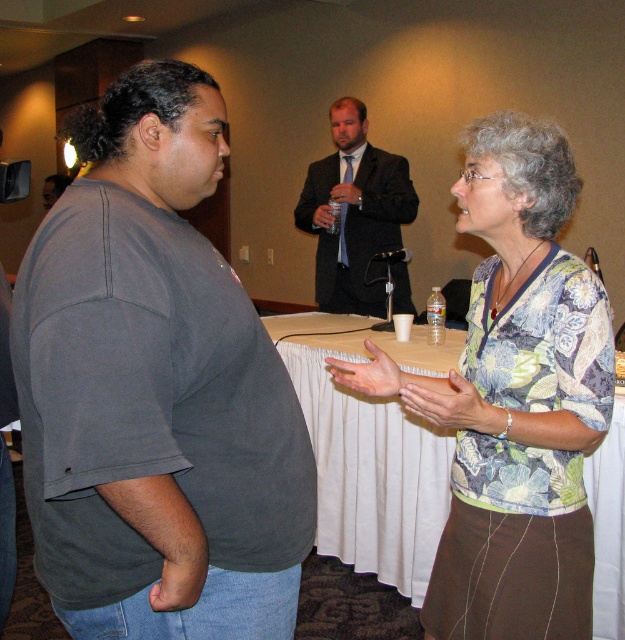
Does dark gray t-shirt at left appear under dark gray suit at center?

Yes, dark gray t-shirt at left is below dark gray suit at center.

Does dark gray t-shirt at left have a lesser width compared to dark gray suit at center?

Correct, dark gray t-shirt at left's width is less than dark gray suit at center's.

Is point (72, 472) in front of point (371, 152)?

Yes.

Where is `dark gray t-shirt at left`? dark gray t-shirt at left is located at coordinates (156, 388).

Which is behind, point (611, 385) or point (390, 205)?

The point (390, 205) is more distant.

Identify the location of floral fabric blouse at center. (515, 397).

Measure the distance from dark gray t-shirt at left to floral fabric blouse at center.

18.19 inches

Can you confirm if dark gray t-shirt at left is bigger than floral fabric blouse at center?

Incorrect, dark gray t-shirt at left is not larger than floral fabric blouse at center.

Where is `dark gray t-shirt at left`? dark gray t-shirt at left is located at coordinates (156, 388).

Where is `dark gray t-shirt at left`? dark gray t-shirt at left is located at coordinates (156, 388).